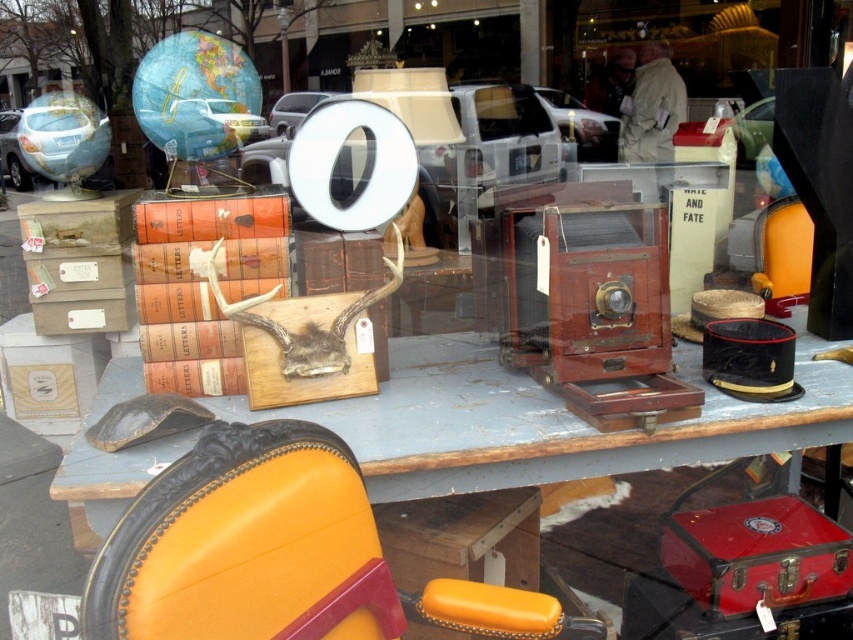
Question: Does leather seat at center appear under wooden table at center?

Choices:
 (A) yes
 (B) no

Answer: (A)

Question: Does leather seat at center appear over wooden table at center?

Choices:
 (A) yes
 (B) no

Answer: (B)

Question: Which object is closer to the camera taking this photo?

Choices:
 (A) leather seat at center
 (B) wooden table at center

Answer: (A)

Question: Is the position of leather seat at center more distant than that of wooden table at center?

Choices:
 (A) yes
 (B) no

Answer: (B)